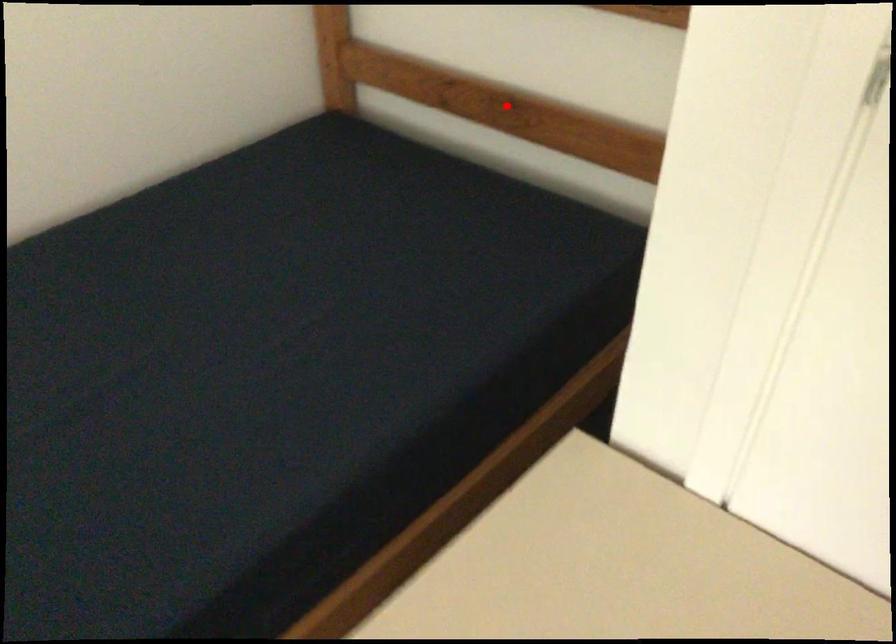
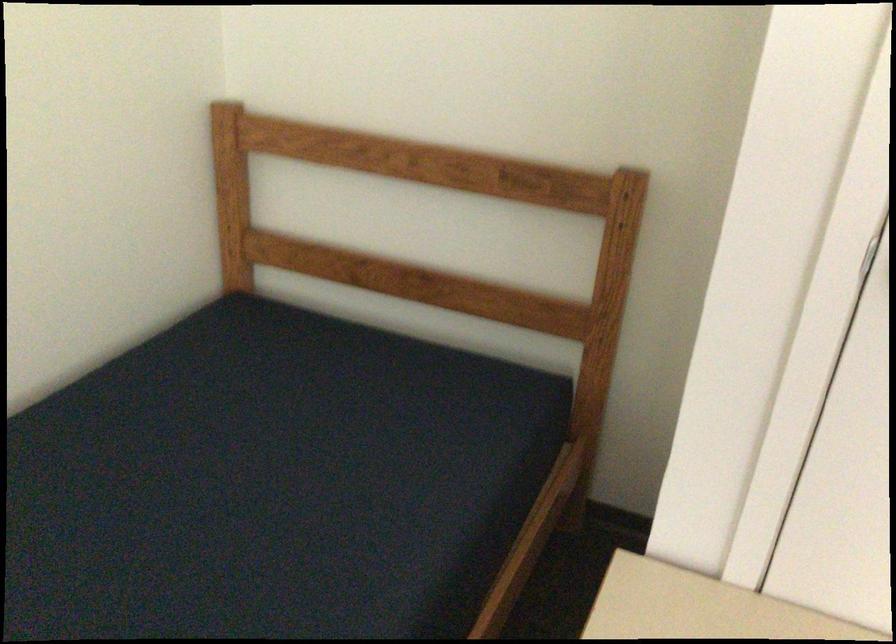
In the second image, find the point that corresponds to the highlighted location in the first image.

(419, 285)